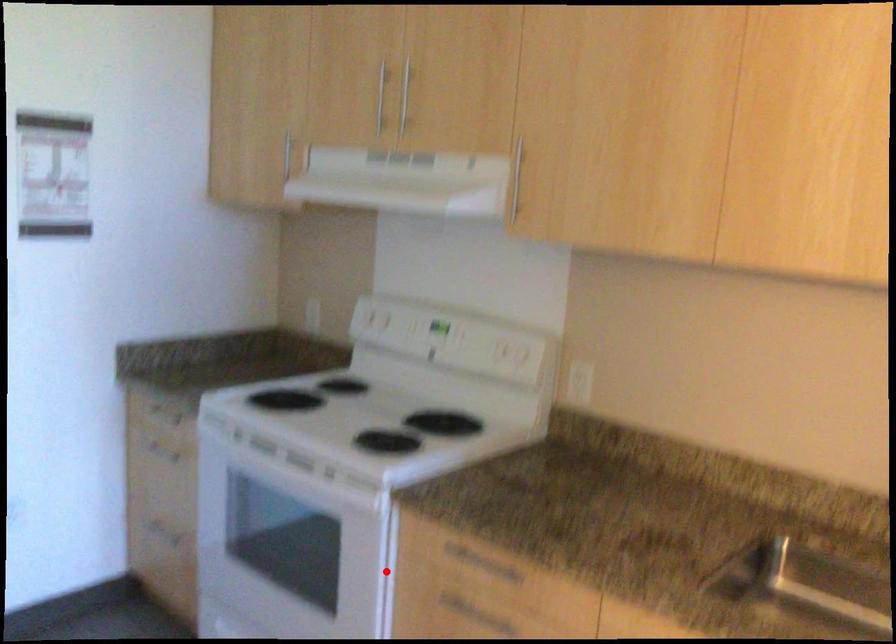
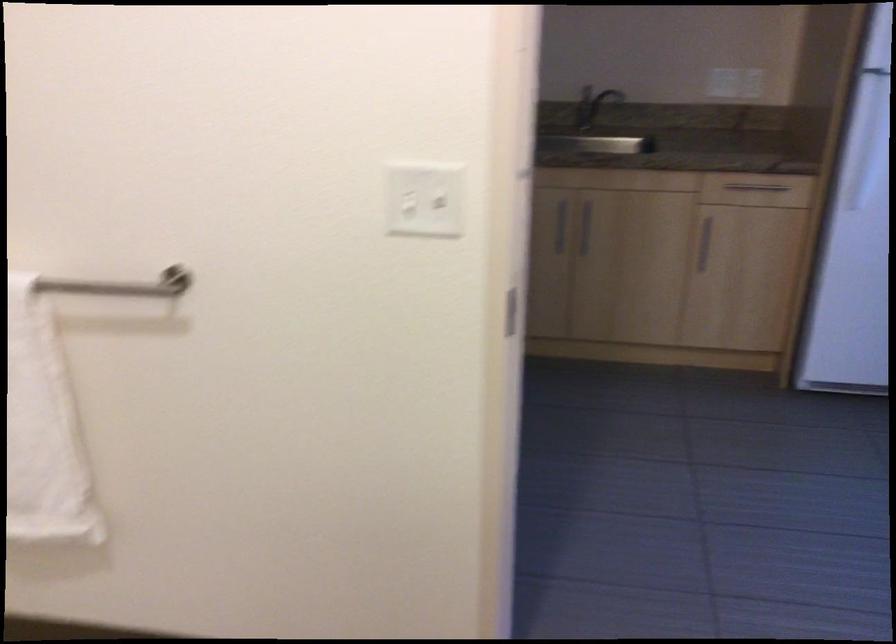
Question: I am providing you with two images of the same scene from different viewpoints. A red point is marked on the first image. Can you still see the location of the red point in image 2?

Choices:
 (A) Yes
 (B) No

Answer: (B)